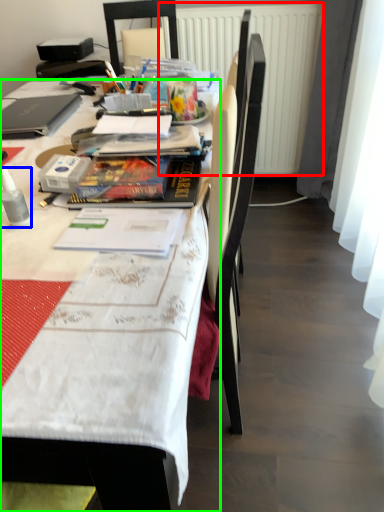
Question: Considering the real-world distances, which object is closest to radiator (highlighted by a red box)? bottle (highlighted by a blue box) or desk (highlighted by a green box).

Choices:
 (A) bottle
 (B) desk

Answer: (B)